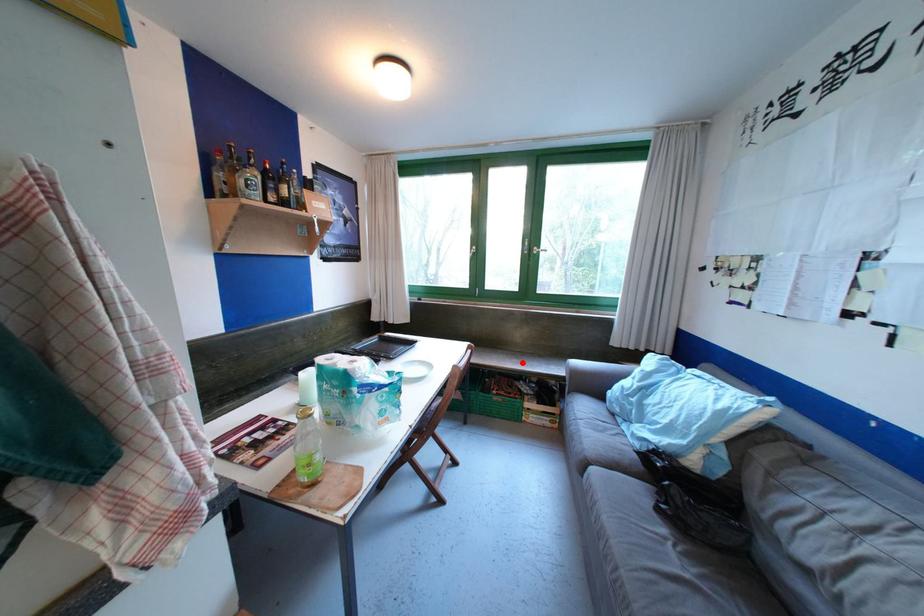
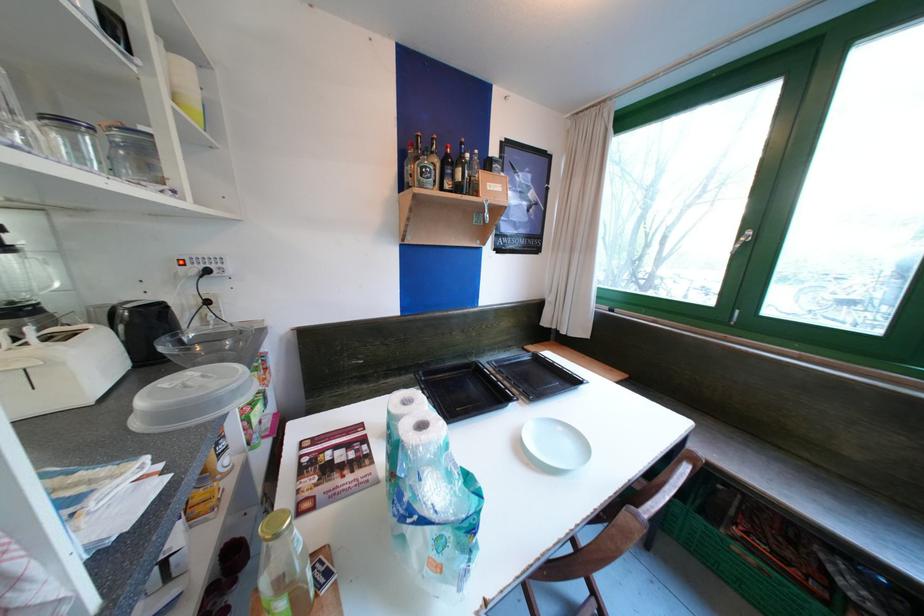
Where in the second image is the point corresponding to the highlighted location from the first image?

(835, 503)